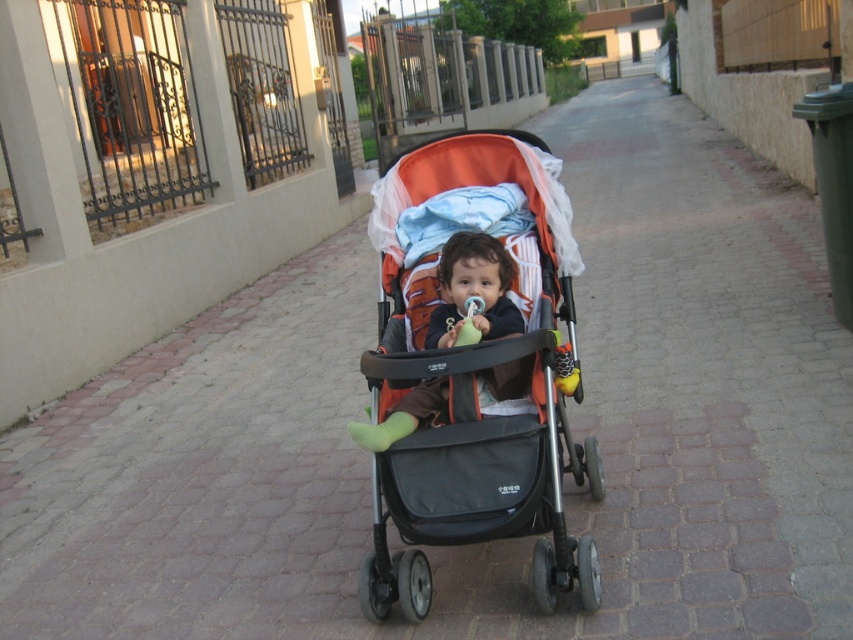
Who is positioned more to the left, orange fabric baby carriage at center or soft orange fabric stroller at center?

Positioned to the left is soft orange fabric stroller at center.

Does orange fabric baby carriage at center have a smaller size compared to soft orange fabric stroller at center?

Incorrect, orange fabric baby carriage at center is not smaller in size than soft orange fabric stroller at center.

This screenshot has width=853, height=640. I want to click on orange fabric baby carriage at center, so click(474, 371).

The height and width of the screenshot is (640, 853). What are the coordinates of `orange fabric baby carriage at center` in the screenshot? It's located at (474, 371).